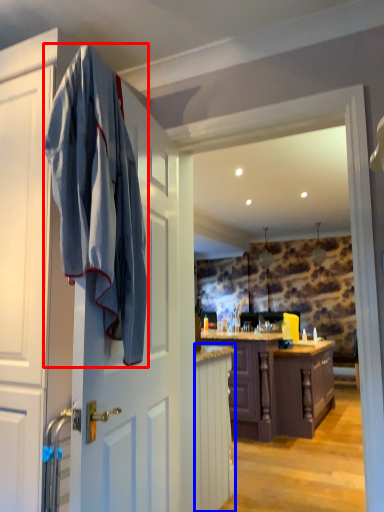
Question: Among these objects, which one is nearest to the camera, bath towel (highlighted by a red box) or cabinetry (highlighted by a blue box)?

Choices:
 (A) bath towel
 (B) cabinetry

Answer: (A)